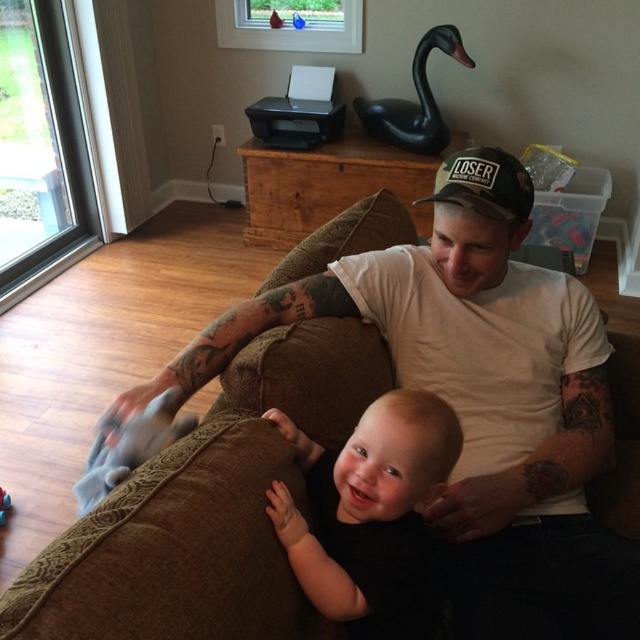
You are a photographer taking a picture of the black matte baby at center and the black fabric baseball cap at center. Which object should you adjust to ensure the baby is positioned to the left of the cap in the photo?

The black matte baby at center is already to the left of the black fabric baseball cap at center, so no adjustment is needed.

You are a photographer setting up for a family portrait. You need to place a small prop between the black matte baby at center and the black fabric baseball cap at center so it can be seen clearly in the photo. Is there enough space between them to fit a prop that is 20 inches long?

The black matte baby at center and black fabric baseball cap at center are 21.43 inches apart, so yes, there is enough space to fit a 20 inches long prop between them.